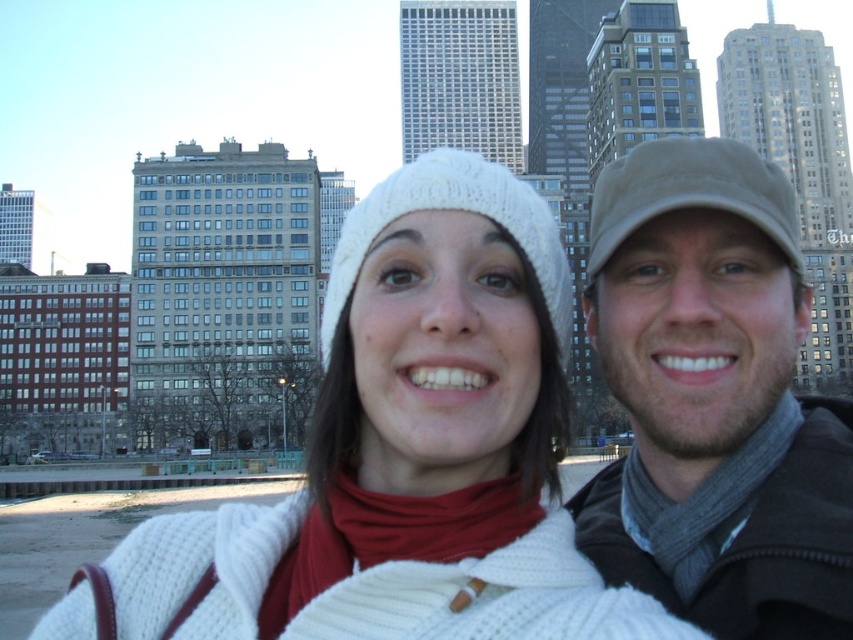
Who is more distant from viewer, (714, 408) or (404, 189)?

Positioned behind is point (404, 189).

Does point (642, 365) lie in front of point (479, 195)?

No, it is not.

Locate an element on the screen. This screenshot has width=853, height=640. khaki fabric cap at upper right is located at coordinates (712, 400).

Does khaki fabric cap at upper right have a greater height compared to beige fabric cap at upper right?

Yes, khaki fabric cap at upper right is taller than beige fabric cap at upper right.

Which is behind, point (769, 208) or point (793, 266)?

The point (793, 266) is behind.

Where is `khaki fabric cap at upper right`? This screenshot has width=853, height=640. khaki fabric cap at upper right is located at coordinates (712, 400).

Can you confirm if white knitted hat at center is shorter than beige fabric cap at upper right?

Incorrect, white knitted hat at center's height does not fall short of beige fabric cap at upper right's.

Is point (387, 186) more distant than point (776, 211)?

That is True.

Between point (436, 164) and point (686, 205), which one is positioned behind?

Positioned behind is point (436, 164).

This screenshot has height=640, width=853. I want to click on white knitted hat at center, so click(456, 209).